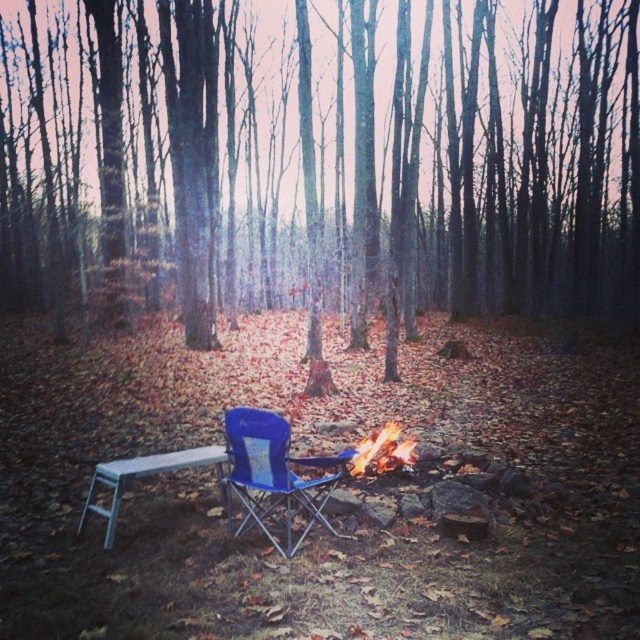
You are planning to take a photo of the smooth bark tree at center and the flaming wood fire at center in the forest scene. Which object should you focus on first if you want to capture both in a single frame without moving the camera?

You should focus on the smooth bark tree at center first because it is much taller than the flaming wood fire at center, so adjusting the focus to the taller object ensures both are in the frame.

You are standing at the campfire and want to sit on the smooth bark tree at center. Can you reach it without moving more than 10 meters?

The smooth bark tree at center is 11.73 meters away from the viewer, so you cannot reach it without moving more than 10 meters.

You are planning to take a photo of the smooth bark tree at center and the flaming wood fire at center in the forest scene. Which object should you focus on first if you want to capture both in a single frame without moving the camera?

The smooth bark tree at center is larger in size than the flaming wood fire at center, so you should focus on the smooth bark tree at center first to ensure it fits properly in the frame before adjusting for the smaller flaming wood fire at center.